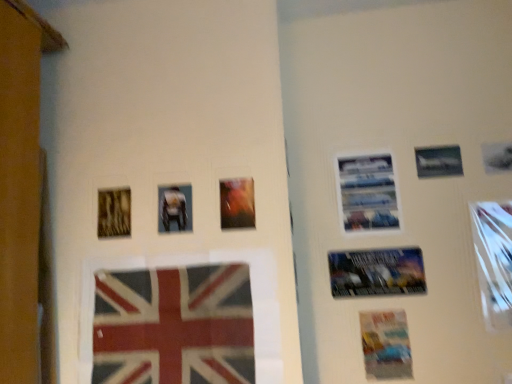
Question: Is metallic silver airplane at upper right, acting as the 4th picture frame starting from the left, positioned beyond the bounds of metallic silver picture frame at right, which appears as the sixth picture frame when viewed from the left?

Choices:
 (A) no
 (B) yes

Answer: (B)

Question: Does metallic silver airplane at upper right, marked as the 3th picture frame in a right-to-left arrangement, contain metallic silver picture frame at right, which appears as the sixth picture frame when viewed from the left?

Choices:
 (A) yes
 (B) no

Answer: (B)

Question: Is metallic silver airplane at upper right, acting as the 4th picture frame starting from the left, shorter than metallic silver picture frame at right, placed as the first picture frame when sorted from right to left?

Choices:
 (A) yes
 (B) no

Answer: (A)

Question: From a real-world perspective, is metallic silver airplane at upper right, acting as the 4th picture frame starting from the left, located higher than metallic silver picture frame at right, placed as the first picture frame when sorted from right to left?

Choices:
 (A) no
 (B) yes

Answer: (B)

Question: Is the depth of metallic silver airplane at upper right, acting as the 4th picture frame starting from the left, greater than that of metallic silver picture frame at right, which appears as the sixth picture frame when viewed from the left?

Choices:
 (A) yes
 (B) no

Answer: (A)

Question: Considering the positions of metallic silver poster at upper right, marked as the third poster in a bottom-to-top arrangement, and metallic silver airplane at upper right, acting as the 4th picture frame starting from the left, in the image, is metallic silver poster at upper right, marked as the third poster in a bottom-to-top arrangement, taller or shorter than metallic silver airplane at upper right, acting as the 4th picture frame starting from the left,?

Choices:
 (A) tall
 (B) short

Answer: (A)

Question: Is metallic silver poster at upper right, the first poster positioned from the top, wider or thinner than metallic silver airplane at upper right, acting as the 4th picture frame starting from the left?

Choices:
 (A) thin
 (B) wide

Answer: (B)

Question: Considering the relative positions of metallic silver poster at upper right, marked as the third poster in a bottom-to-top arrangement, and metallic silver airplane at upper right, acting as the 4th picture frame starting from the left, in the image provided, is metallic silver poster at upper right, marked as the third poster in a bottom-to-top arrangement, to the left or to the right of metallic silver airplane at upper right, acting as the 4th picture frame starting from the left,?

Choices:
 (A) left
 (B) right

Answer: (A)

Question: Looking at the image, does metallic silver poster at upper right, the first poster positioned from the top, seem bigger or smaller compared to metallic silver airplane at upper right, acting as the 4th picture frame starting from the left?

Choices:
 (A) small
 (B) big

Answer: (B)

Question: Is point (164, 225) positioned closer to the camera than point (98, 195)?

Choices:
 (A) farther
 (B) closer

Answer: (B)

Question: Considering the relative positions of matte plastic photo frame at center, which is the second picture frame in left-to-right order, and wooden textured frame at left, arranged as the 6th picture frame when viewed from the right, in the image provided, is matte plastic photo frame at center, which is the second picture frame in left-to-right order, to the left or to the right of wooden textured frame at left, arranged as the 6th picture frame when viewed from the right,?

Choices:
 (A) right
 (B) left

Answer: (A)

Question: Is matte plastic photo frame at center, which is the 5th picture frame in right-to-left order, taller or shorter than wooden textured frame at left, arranged as the 6th picture frame when viewed from the right?

Choices:
 (A) short
 (B) tall

Answer: (A)

Question: From a real-world perspective, is matte plastic photo frame at center, which is the second picture frame in left-to-right order, physically located above or below wooden textured frame at left, marked as the first picture frame in a left-to-right arrangement?

Choices:
 (A) below
 (B) above

Answer: (A)

Question: Looking at the image, does metallic silver poster at center right, the 2th poster when ordered from bottom to top, seem bigger or smaller compared to textured fabric flag at lower center?

Choices:
 (A) big
 (B) small

Answer: (B)

Question: Which is correct: metallic silver poster at center right, the 2th poster when ordered from bottom to top, is inside textured fabric flag at lower center, or outside of it?

Choices:
 (A) inside
 (B) outside

Answer: (B)